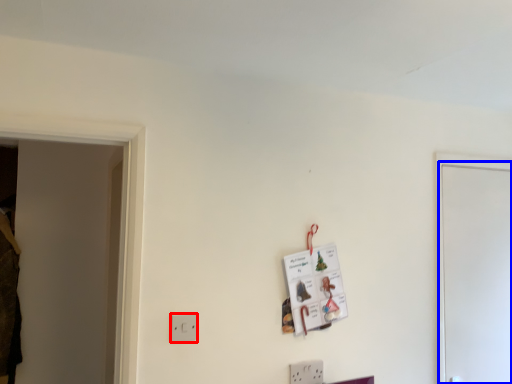
Question: Among these objects, which one is farthest to the camera, light switch (highlighted by a red box) or door (highlighted by a blue box)?

Choices:
 (A) light switch
 (B) door

Answer: (B)